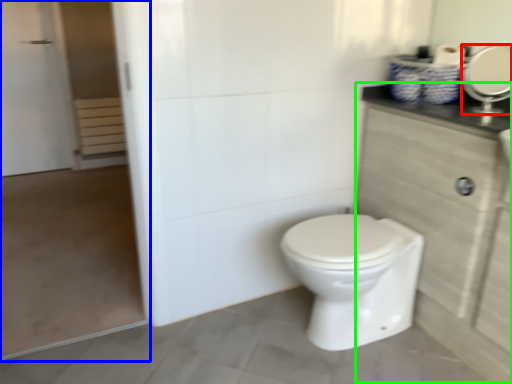
Question: Considering the real-world distances, which object is farthest from mirror (highlighted by a red box)? screen door (highlighted by a blue box) or dresser (highlighted by a green box)?

Choices:
 (A) screen door
 (B) dresser

Answer: (A)